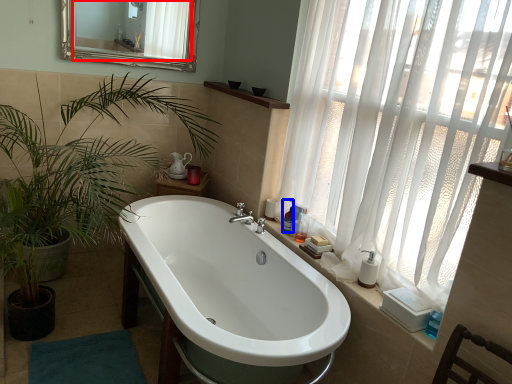
Question: Which object appears closest to the camera in this image, mirror (highlighted by a red box) or toiletry (highlighted by a blue box)?

Choices:
 (A) mirror
 (B) toiletry

Answer: (B)